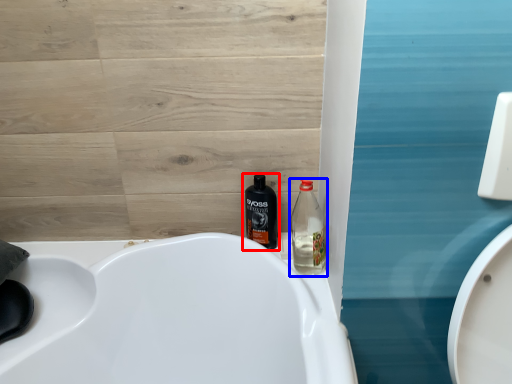
Question: Which object is further to the camera taking this photo, bottle (highlighted by a red box) or bottle (highlighted by a blue box)?

Choices:
 (A) bottle
 (B) bottle

Answer: (A)